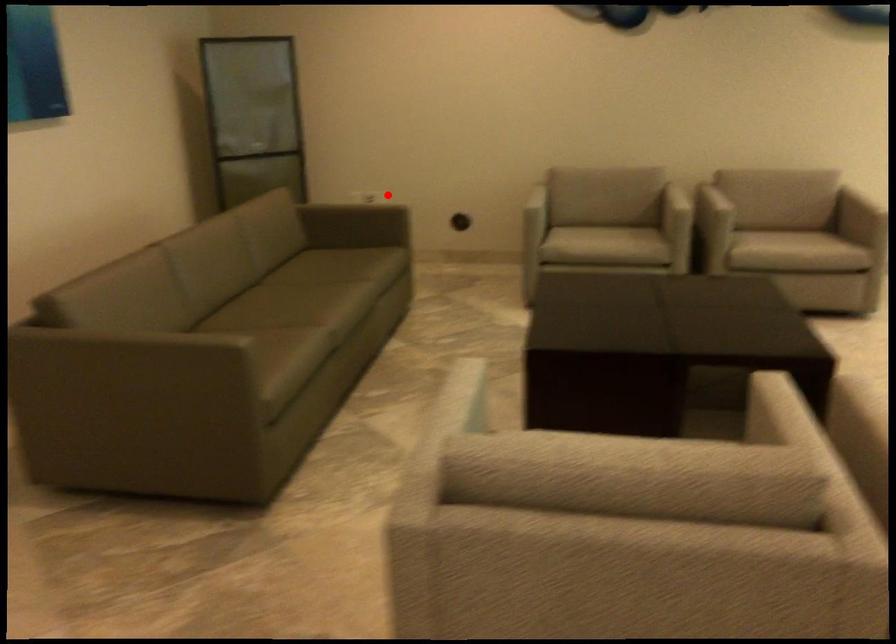
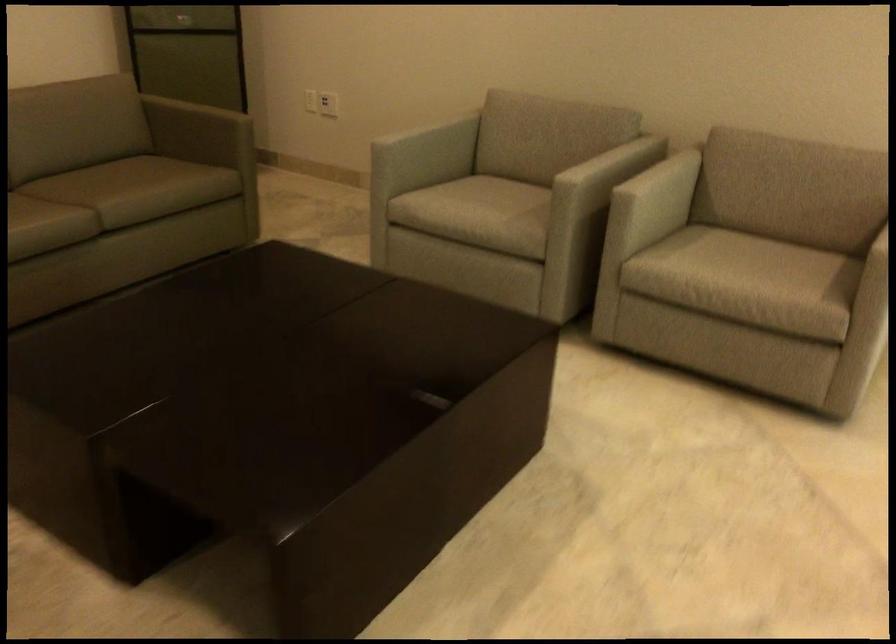
Where in the second image is the point corresponding to the highlighted location from the first image?

(328, 104)